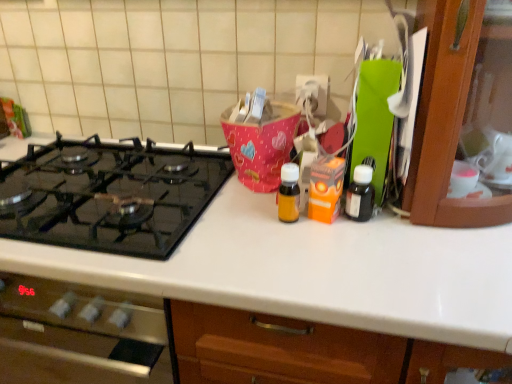
Question: Is black glass gas stove at left inside or outside of black matte bottle at right, which is the second bottle from left to right?

Choices:
 (A) inside
 (B) outside

Answer: (B)

Question: Is point (144, 210) positioned closer to the camera than point (354, 193)?

Choices:
 (A) closer
 (B) farther

Answer: (B)

Question: Which is farther from the translucent amber bottle at center, acting as the 1th bottle starting from the left?

Choices:
 (A) black matte bottle at right, which is the second bottle from left to right
 (B) black glass gas stove at left

Answer: (B)

Question: Which is nearer to the black matte bottle at right, which is the second bottle from left to right?

Choices:
 (A) black glass gas stove at left
 (B) translucent amber bottle at center, acting as the 1th bottle starting from the left

Answer: (B)